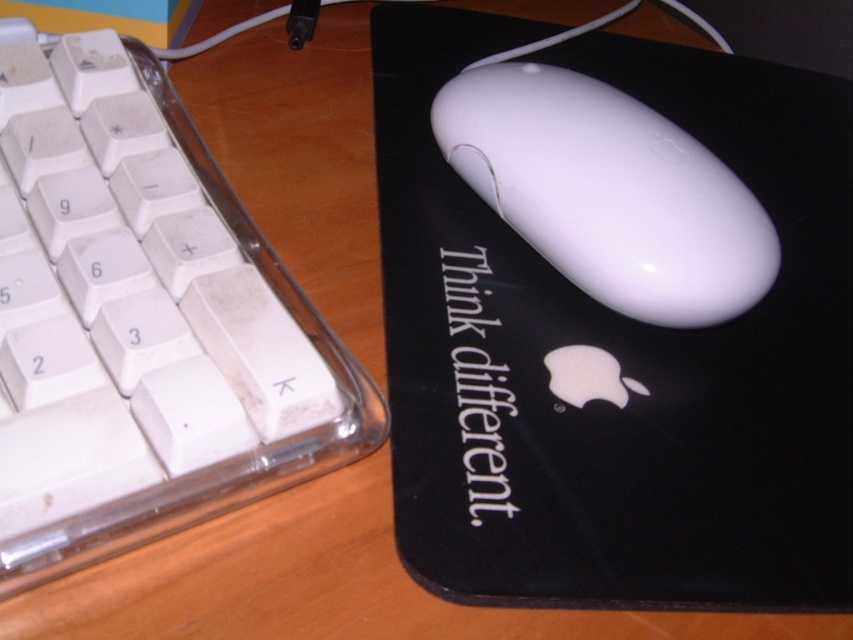
Question: Which object is positioned farthest from the white glossy mouse at center?

Choices:
 (A) white plastic keyboard at left
 (B) black matte mousepad at center

Answer: (A)

Question: Is black matte mousepad at center closer to the viewer compared to white plastic keyboard at left?

Choices:
 (A) yes
 (B) no

Answer: (B)

Question: Can you confirm if black matte mousepad at center is positioned to the left of white glossy mouse at center?

Choices:
 (A) no
 (B) yes

Answer: (A)

Question: Which object appears farthest from the camera in this image?

Choices:
 (A) white glossy mouse at center
 (B) black matte mousepad at center
 (C) white plastic keyboard at left

Answer: (A)

Question: Which of the following is the farthest from the observer?

Choices:
 (A) black matte mousepad at center
 (B) white glossy mouse at center
 (C) white plastic keyboard at left

Answer: (B)

Question: Is black matte mousepad at center bigger than white glossy mouse at center?

Choices:
 (A) no
 (B) yes

Answer: (B)